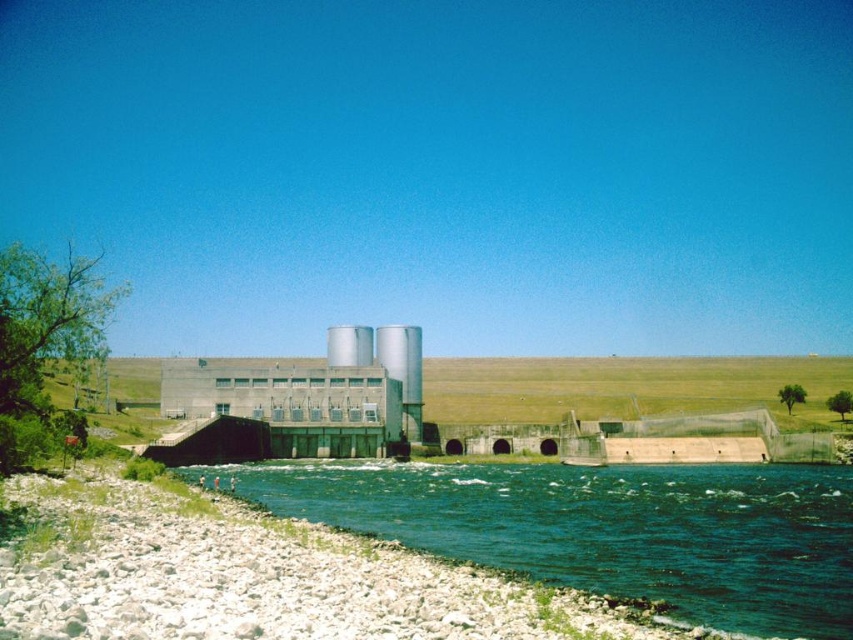
Which is above, green smooth water at lower left or concrete gray power station at center?

Positioned higher is concrete gray power station at center.

Is green smooth water at lower left taller than concrete gray power station at center?

No, green smooth water at lower left is not taller than concrete gray power station at center.

Who is more distant from viewer, (813, 550) or (175, 394)?

The point (175, 394) is more distant.

Locate an element on the screen. This screenshot has width=853, height=640. green smooth water at lower left is located at coordinates (604, 529).

Is the position of concrete gray power station at center more distant than that of silver metallic silo at center?

No.

Is concrete gray power station at center taller than silver metallic silo at center?

Correct, concrete gray power station at center is much taller as silver metallic silo at center.

Which is in front, point (340, 401) or point (329, 336)?

Positioned in front is point (340, 401).

Find the location of a particular element. concrete gray power station at center is located at coordinates click(315, 394).

Which is more to the left, green smooth water at lower left or silver metallic silo at center?

Positioned to the left is silver metallic silo at center.

Can you confirm if green smooth water at lower left is thinner than silver metallic silo at center?

In fact, green smooth water at lower left might be wider than silver metallic silo at center.

The width and height of the screenshot is (853, 640). What are the coordinates of `green smooth water at lower left` in the screenshot? It's located at (604, 529).